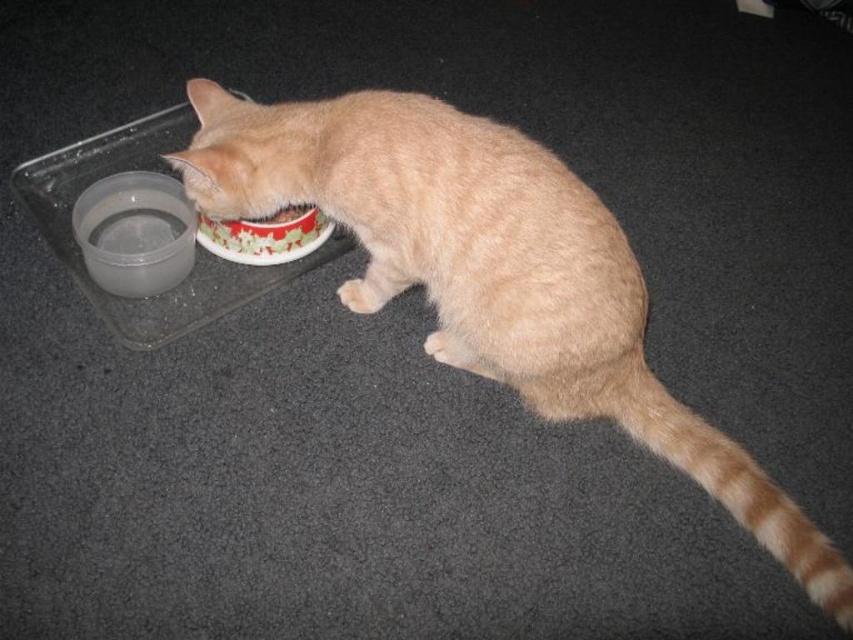
Is light brown fur cat at center below red glossy bowl at center?

Yes.

Does light brown fur cat at center appear on the right side of red glossy bowl at center?

Yes, light brown fur cat at center is to the right of red glossy bowl at center.

You are a GUI agent. You are given a task and a screenshot of the screen. Output one action in this format:
    pyautogui.click(x=<x>, y=<y>)
    Task: Click on the light brown fur cat at center
    This screenshot has width=853, height=640.
    Given the screenshot: What is the action you would take?
    pyautogui.click(x=491, y=273)

Does light brown fur cat at center have a greater width compared to transparent plastic bowl at lower left?

Correct, the width of light brown fur cat at center exceeds that of transparent plastic bowl at lower left.

The width and height of the screenshot is (853, 640). What do you see at coordinates (491, 273) in the screenshot? I see `light brown fur cat at center` at bounding box center [491, 273].

Locate an element on the screen. This screenshot has width=853, height=640. light brown fur cat at center is located at coordinates (491, 273).

Based on the photo, does transparent plastic bowl at lower left have a greater width compared to red glossy bowl at center?

Incorrect, transparent plastic bowl at lower left's width does not surpass red glossy bowl at center's.

The image size is (853, 640). I want to click on transparent plastic bowl at lower left, so click(x=135, y=232).